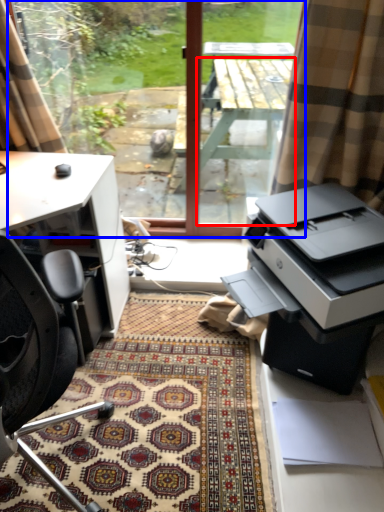
Question: Which object appears farthest to the camera in this image, table (highlighted by a red box) or window screen (highlighted by a blue box)?

Choices:
 (A) table
 (B) window screen

Answer: (B)